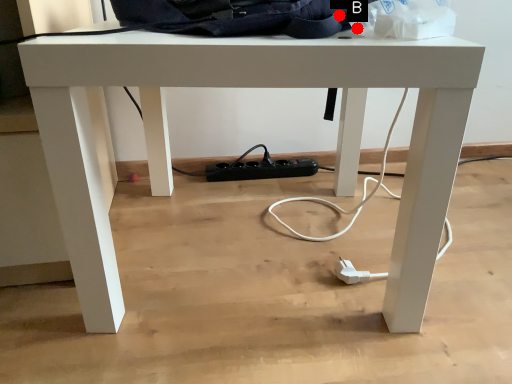
Question: Two points are circled on the image, labeled by A and B beside each circle. Among these points, which one is nearest to the camera?

Choices:
 (A) A is closer
 (B) B is closer

Answer: (A)